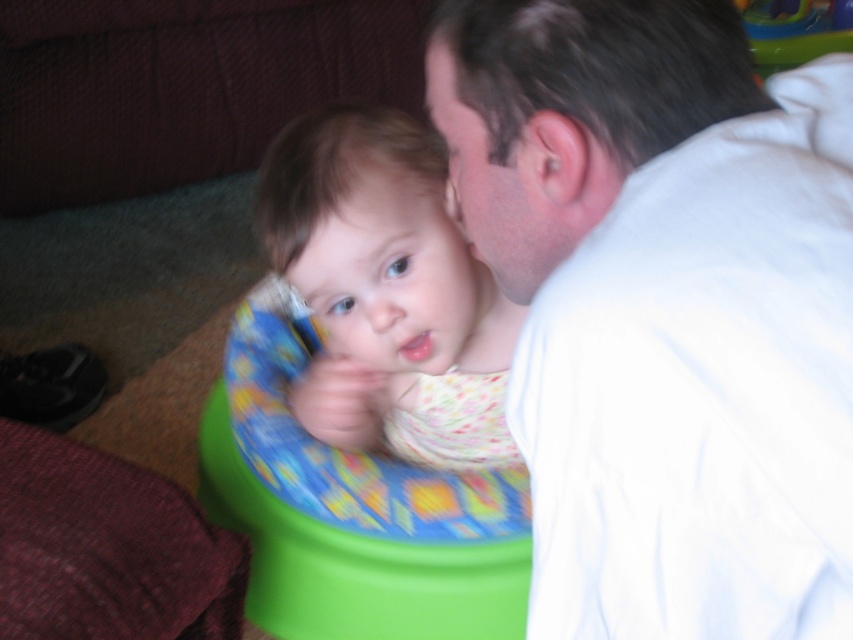
From the picture: Does white smooth shirt at upper right appear under floral fabric baby at center?

Incorrect, white smooth shirt at upper right is not positioned below floral fabric baby at center.

Does white smooth shirt at upper right have a greater height compared to floral fabric baby at center?

Incorrect, white smooth shirt at upper right's height is not larger of floral fabric baby at center's.

Is point (625, 332) closer to camera compared to point (408, 364)?

Yes, it is in front of point (408, 364).

Locate an element on the screen. This screenshot has width=853, height=640. white smooth shirt at upper right is located at coordinates (664, 308).